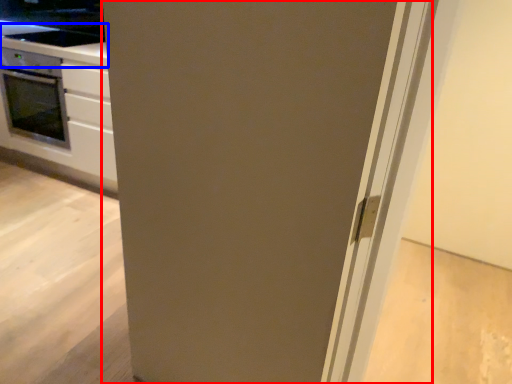
Question: Which object is further to the camera taking this photo, door (highlighted by a red box) or counter top (highlighted by a blue box)?

Choices:
 (A) door
 (B) counter top

Answer: (B)